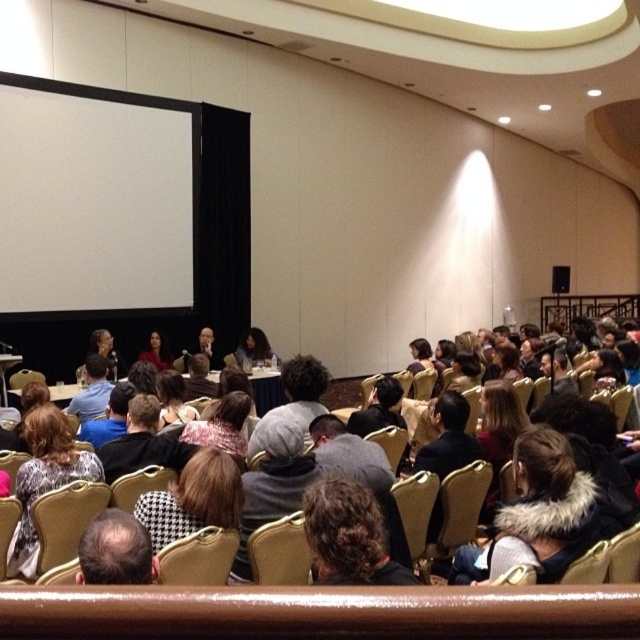
Question: From the image, what is the correct spatial relationship of white matte projection screen at upper left in relation to matte black jacket at center?

Choices:
 (A) right
 (B) left

Answer: (B)

Question: Based on their relative distances, which object is nearer to the dark brown hair at lower left?

Choices:
 (A) white matte projection screen at upper left
 (B) leather at center
 (C) printed fabric coat at lower left

Answer: (B)

Question: Does white matte projection screen at upper left lie in front of printed fabric coat at lower left?

Choices:
 (A) yes
 (B) no

Answer: (B)

Question: Among these points, which one is farthest from the camera?

Choices:
 (A) (154, 298)
 (B) (160, 360)

Answer: (A)

Question: Does matte black laptop at center have a smaller size compared to matte black jacket at center?

Choices:
 (A) yes
 (B) no

Answer: (B)

Question: Estimate the real-world distances between objects in this image. Which object is closer to the white matte projection screen at upper left?

Choices:
 (A) dark curly hair at center
 (B) leather at center
 (C) printed fabric coat at lower left

Answer: (C)